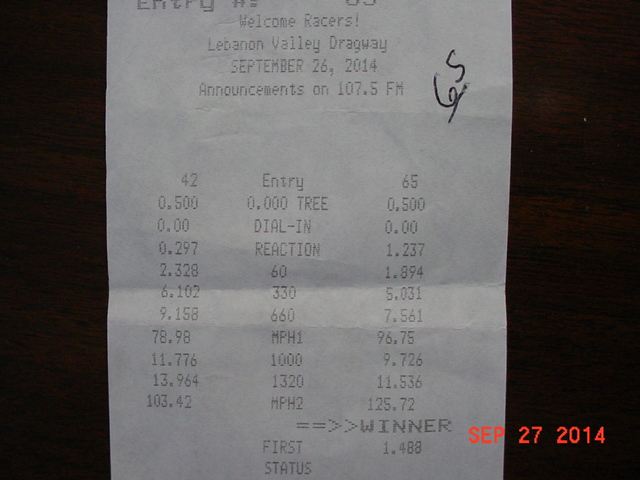
This screenshot has width=640, height=480. Find the location of `table`. table is located at coordinates (38, 227).